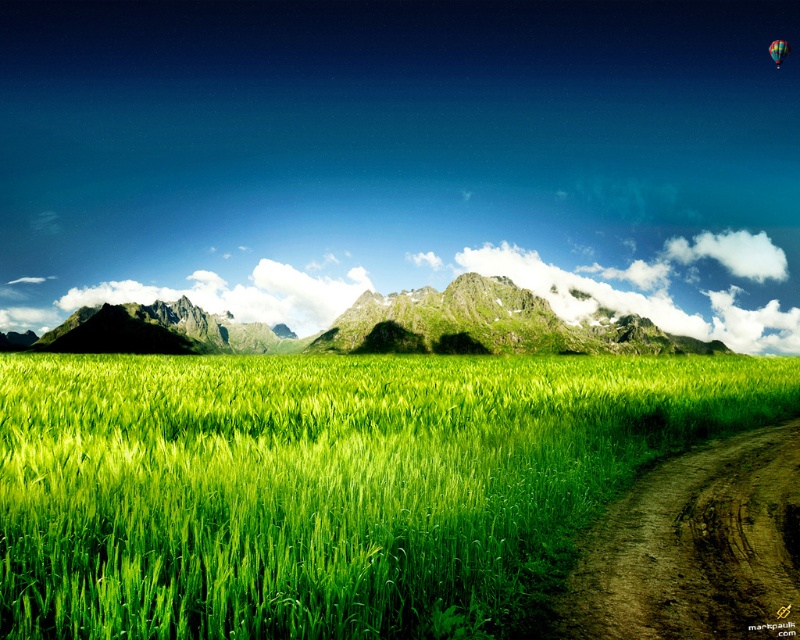
Question: Is green grassy mountain at center closer to the viewer compared to multicolored fabric balloon at upper right?

Choices:
 (A) yes
 (B) no

Answer: (B)

Question: Which point is closer to the camera?

Choices:
 (A) green grassy wheat field at center
 (B) multicolored fabric balloon at upper right
 (C) green grassy mountain at center

Answer: (A)

Question: Which of the following is the farthest from the observer?

Choices:
 (A) multicolored fabric balloon at upper right
 (B) green grassy mountain at center
 (C) green grassy wheat field at center

Answer: (B)

Question: Is green grassy mountain at center closer to camera compared to multicolored fabric balloon at upper right?

Choices:
 (A) yes
 (B) no

Answer: (B)

Question: Can you confirm if green grassy mountain at center is bigger than multicolored fabric balloon at upper right?

Choices:
 (A) yes
 (B) no

Answer: (A)

Question: Among these objects, which one is nearest to the camera?

Choices:
 (A) green grassy mountain at center
 (B) green grassy wheat field at center
 (C) multicolored fabric balloon at upper right

Answer: (B)